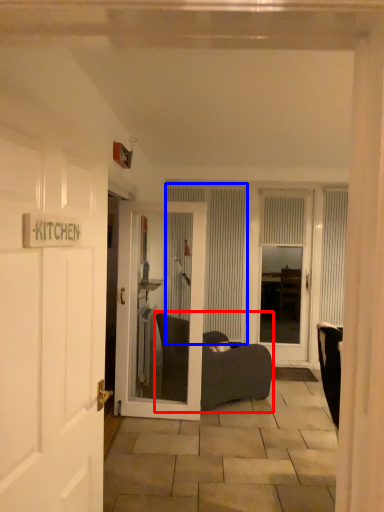
Question: Among these objects, which one is farthest to the camera, furniture (highlighted by a red box) or curtain (highlighted by a blue box)?

Choices:
 (A) furniture
 (B) curtain

Answer: (B)